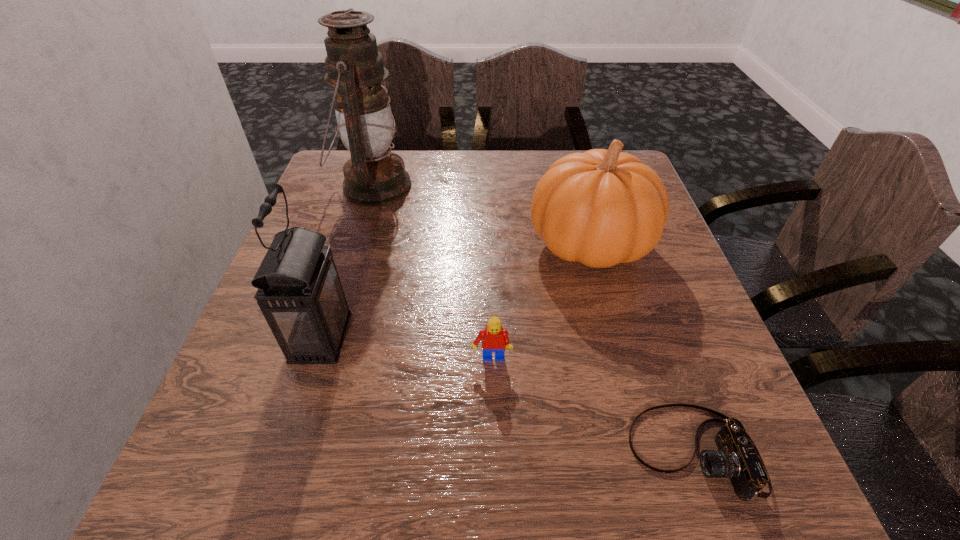
Where is `the tallest object`? the tallest object is located at coordinates (374, 176).

At what (x,y) coordinates should I click in order to perform the action: click on the fourth shortest object. Please return your answer as a coordinate pair (x, y). This screenshot has height=540, width=960. Looking at the image, I should click on (299, 292).

At what (x,y) coordinates should I click in order to perform the action: click on pumpkin. Please return your answer as a coordinate pair (x, y). This screenshot has width=960, height=540. Looking at the image, I should click on (600, 208).

This screenshot has width=960, height=540. In order to click on the third object from right to left in this screenshot , I will do `click(494, 339)`.

Locate an element on the screen. The image size is (960, 540). the fourth tallest object is located at coordinates (494, 339).

At what (x,y) coordinates should I click in order to perform the action: click on the nearest object. Please return your answer as a coordinate pair (x, y). The image size is (960, 540). Looking at the image, I should click on (737, 458).

The height and width of the screenshot is (540, 960). What are the coordinates of `the shortest object` in the screenshot? It's located at (737, 458).

Where is `vacant position located 0.250m on the right of the lantern`? The width and height of the screenshot is (960, 540). vacant position located 0.250m on the right of the lantern is located at coordinates (507, 186).

Find the location of a particular element. The height and width of the screenshot is (540, 960). vacant space located on the front-facing side of the lantern is located at coordinates (447, 337).

The image size is (960, 540). What are the coordinates of `vacant point located 0.180m on the left of the pumpkin` in the screenshot? It's located at pos(447,244).